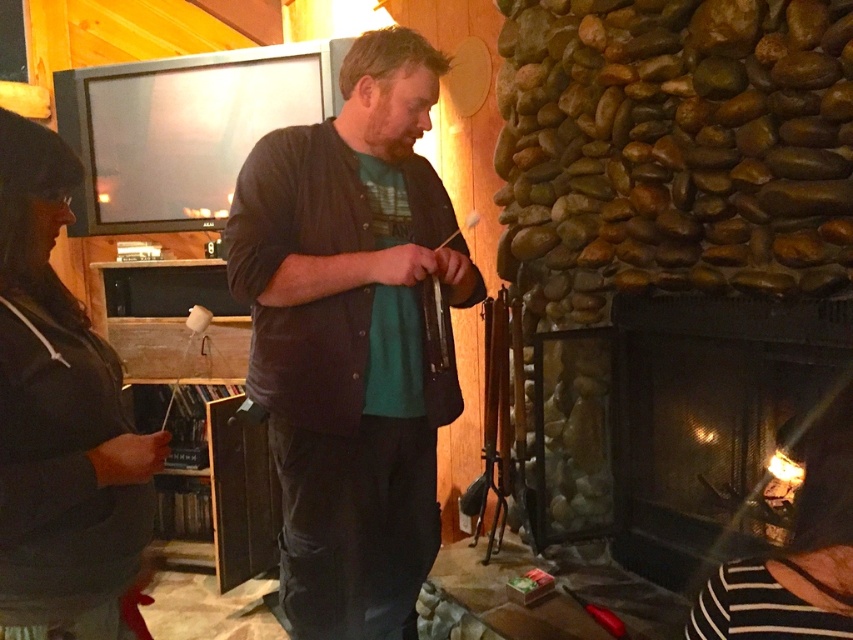
Question: Can you confirm if dark brown leather jacket at center is wider than black glass fireplace at lower right?

Choices:
 (A) no
 (B) yes

Answer: (A)

Question: Which point is farther from the camera taking this photo?

Choices:
 (A) (541, 536)
 (B) (4, 547)

Answer: (A)

Question: Among these points, which one is farthest from the camera?

Choices:
 (A) pyautogui.click(x=294, y=435)
 (B) pyautogui.click(x=624, y=525)
 (C) pyautogui.click(x=15, y=483)

Answer: (B)

Question: Which object is farther from the camera taking this photo?

Choices:
 (A) black glass fireplace at lower right
 (B) dark gray sweater at left
 (C) dark brown leather jacket at center

Answer: (A)

Question: Can you confirm if black glass fireplace at lower right is thinner than dark gray sweater at left?

Choices:
 (A) yes
 (B) no

Answer: (B)

Question: Can you confirm if black glass fireplace at lower right is positioned above dark gray sweater at left?

Choices:
 (A) no
 (B) yes

Answer: (A)